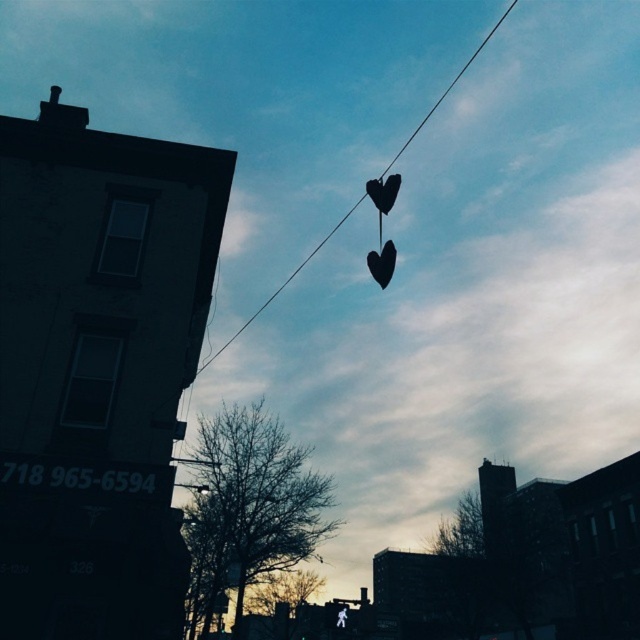
You are a delivery person who needs to deliver a package to the building with the phone number 718 965 6594. The black matte heart at center is blocking the entrance. Can you move around it to reach the entrance?

The black matte heart at center is located at point (381, 262), so you can move around it to reach the entrance as it is not directly in the path of the entrance.

You are standing at a distance of 25 feet from the building with the phone number displayed. If you want to move closer to the point at coordinates point (381,289), will you be able to reach it without moving beyond the 30 feet distance limit?

The distance of point (381,289) from viewer is 31.64 feet, so you cannot reach it without exceeding the 30 feet distance limit since it is 1.64 feet further away.